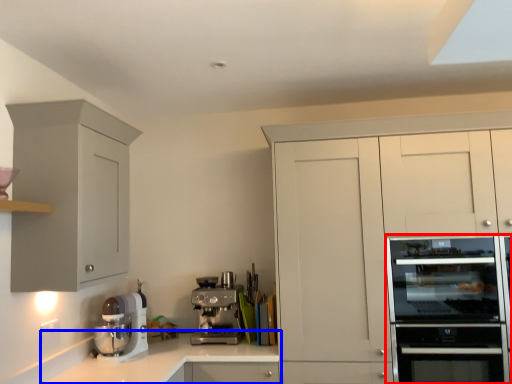
Question: Among these objects, which one is farthest to the camera, home appliance (highlighted by a red box) or countertop (highlighted by a blue box)?

Choices:
 (A) home appliance
 (B) countertop

Answer: (B)